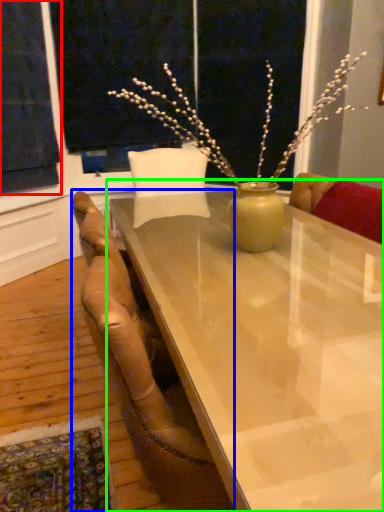
Question: Which object is the farthest from curtain (highlighted by a red box)? Choose among these: chair (highlighted by a blue box) or table (highlighted by a green box).

Choices:
 (A) chair
 (B) table

Answer: (B)